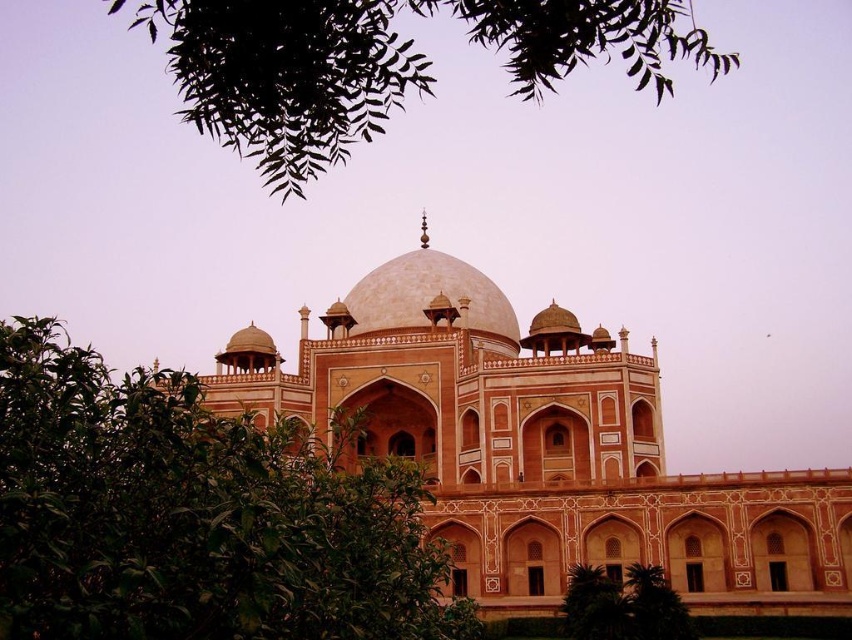
Between green leafy tree at upper center and smooth beige dome at center, which one is positioned higher?

green leafy tree at upper center

Does green leafy tree at upper center have a greater width compared to smooth beige dome at center?

Yes.

At what (x,y) coordinates should I click in order to perform the action: click on green leafy tree at upper center. Please return your answer as a coordinate pair (x, y). The height and width of the screenshot is (640, 852). Looking at the image, I should click on (384, 64).

At what (x,y) coordinates should I click in order to perform the action: click on green leafy tree at upper center. Please return your answer as a coordinate pair (x, y). Looking at the image, I should click on (384, 64).

Does beige stone palace at center have a larger size compared to smooth beige dome at center?

Yes.

Which of these two, beige stone palace at center or smooth beige dome at center, stands shorter?

→ Standing shorter between the two is smooth beige dome at center.

Is point (741, 593) positioned after point (455, 285)?

No, (741, 593) is in front of (455, 285).

At what (x,y) coordinates should I click in order to perform the action: click on beige stone palace at center. Please return your answer as a coordinate pair (x, y). Looking at the image, I should click on (540, 448).

Between beige stone palace at center and green leafy tree at lower center, which one has less height?

green leafy tree at lower center is shorter.

Between point (422, 221) and point (663, 634), which one is positioned behind?

Positioned behind is point (422, 221).

Which is behind, point (567, 529) or point (590, 596)?

The point (567, 529) is more distant.

Locate an element on the screen. beige stone palace at center is located at coordinates (540, 448).